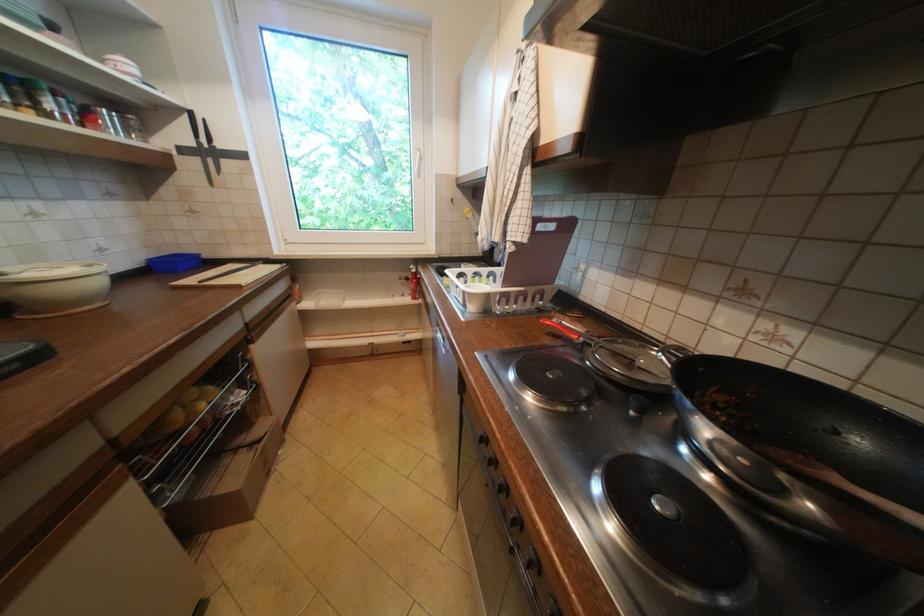
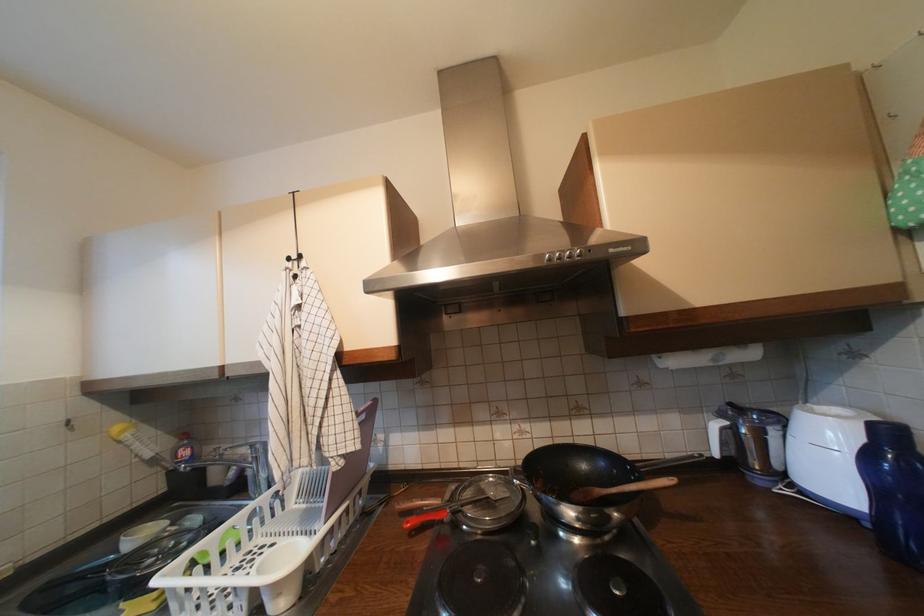
Where in the second image is the point corresponding to the point at 563,314 from the first image?

(407, 506)